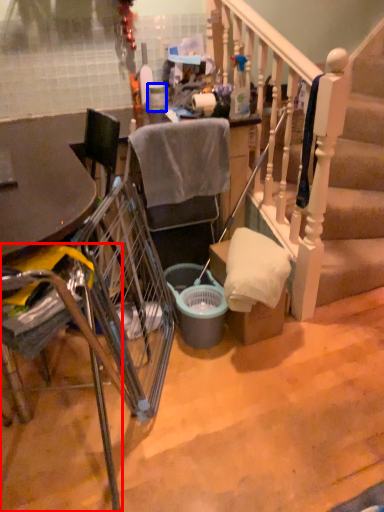
Question: Which object appears closest to the camera in this image, chair (highlighted by a red box) or trash bin/can (highlighted by a blue box)?

Choices:
 (A) chair
 (B) trash bin/can

Answer: (A)